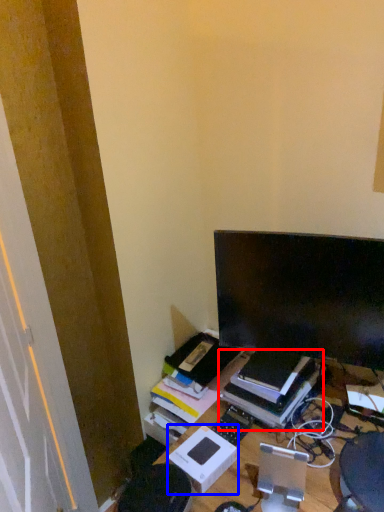
Question: Which of the following is the closest to the observer, book (highlighted by a red box) or cardboard box (highlighted by a blue box)?

Choices:
 (A) book
 (B) cardboard box

Answer: (B)